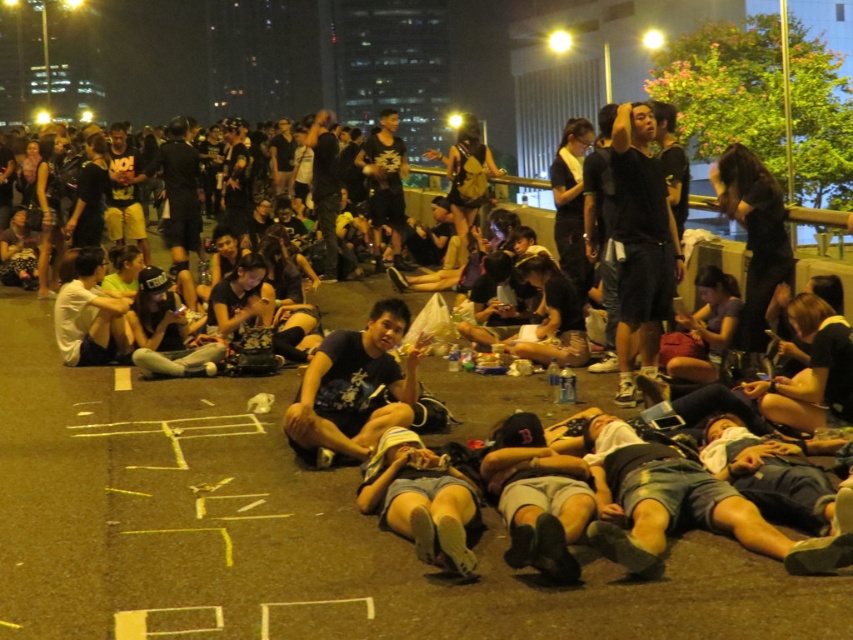
Is black matte shorts at center thinner than white matte shirt at center?

In fact, black matte shorts at center might be wider than white matte shirt at center.

Which of these two, black matte shorts at center or white matte shirt at center, stands taller?

With more height is black matte shorts at center.

Who is more forward, (642, 349) or (70, 284)?

Point (642, 349) is more forward.

The height and width of the screenshot is (640, 853). Find the location of `black matte shorts at center`. black matte shorts at center is located at coordinates (640, 246).

Locate an element on the screen. dark gray fabric cap at center is located at coordinates (537, 497).

Between point (569, 474) and point (425, 502), which one is positioned behind?

The point (569, 474) is more distant.

Is point (526, 480) less distant than point (379, 509)?

Yes, point (526, 480) is closer to viewer.

Image resolution: width=853 pixels, height=640 pixels. Find the location of `dark gray fabric cap at center`. dark gray fabric cap at center is located at coordinates (537, 497).

Can you confirm if dark asphalt pavement at center is positioned to the right of dark gray fabric cap at center?

No, dark asphalt pavement at center is not to the right of dark gray fabric cap at center.

Which is above, dark asphalt pavement at center or dark gray fabric cap at center?

dark asphalt pavement at center is above.

Does point (291, 506) come in front of point (496, 486)?

No.

This screenshot has height=640, width=853. Find the location of `dark asphalt pavement at center`. dark asphalt pavement at center is located at coordinates (288, 531).